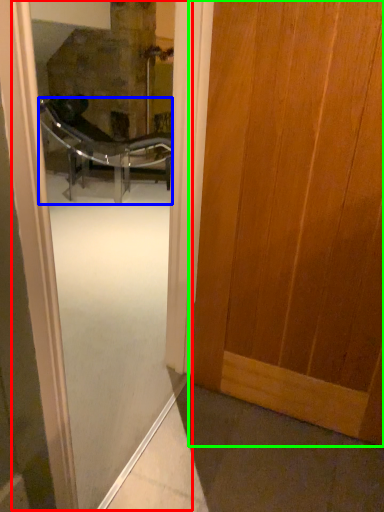
Question: Which object is positioned closest to screen door (highlighted by a red box)? Select from chair (highlighted by a blue box) and door (highlighted by a green box).

Choices:
 (A) chair
 (B) door

Answer: (A)